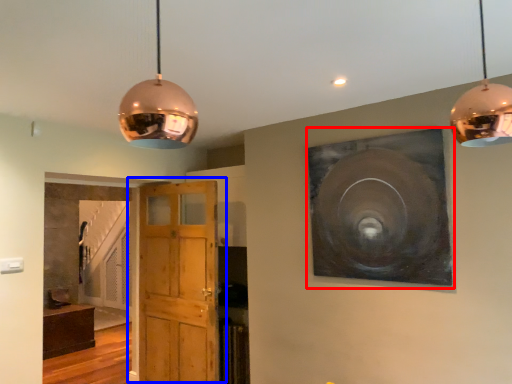
Question: Which object is closer to the camera taking this photo, picture frame (highlighted by a red box) or door (highlighted by a blue box)?

Choices:
 (A) picture frame
 (B) door

Answer: (A)